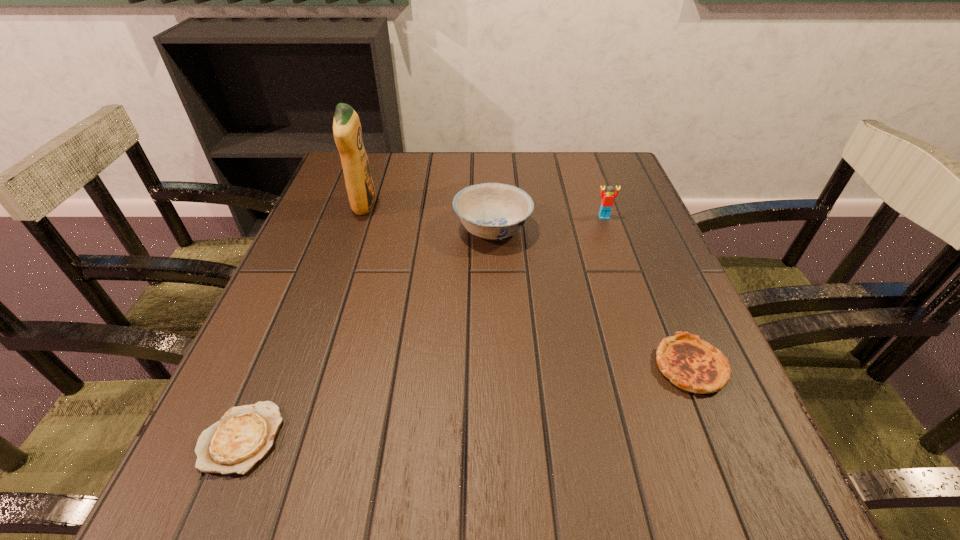
Locate an element on the screen. This screenshot has width=960, height=540. free spot located 0.390m on the left of the fourth tallest object is located at coordinates (420, 367).

The height and width of the screenshot is (540, 960). What are the coordinates of `free point located 0.070m on the right of the nearer quiche` in the screenshot? It's located at (327, 437).

At what (x,y) coordinates should I click in order to perform the action: click on object located in the far edge section of the desktop. Please return your answer as a coordinate pair (x, y). This screenshot has height=540, width=960. Looking at the image, I should click on (347, 131).

This screenshot has width=960, height=540. I want to click on object at the near edge, so click(245, 434).

This screenshot has height=540, width=960. What are the coordinates of `detergent that is at the left edge` in the screenshot? It's located at (347, 131).

This screenshot has height=540, width=960. In order to click on quiche at the left edge in this screenshot , I will do `click(245, 434)`.

Where is `Lego situated at the right edge`? This screenshot has height=540, width=960. Lego situated at the right edge is located at coordinates (607, 198).

The height and width of the screenshot is (540, 960). Find the location of `quiche at the right edge`. quiche at the right edge is located at coordinates 694,365.

At what (x,y) coordinates should I click in order to perform the action: click on object that is positioned at the far left corner. Please return your answer as a coordinate pair (x, y). Image resolution: width=960 pixels, height=540 pixels. Looking at the image, I should click on (347, 131).

Locate an element on the screen. This screenshot has width=960, height=540. object located in the near left corner section of the desktop is located at coordinates (245, 434).